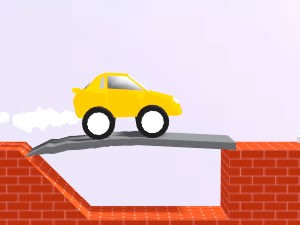
Find the location of a particular element. Image resolution: width=300 pixels, height=225 pixels. windows is located at coordinates point(117,83), point(104,83).